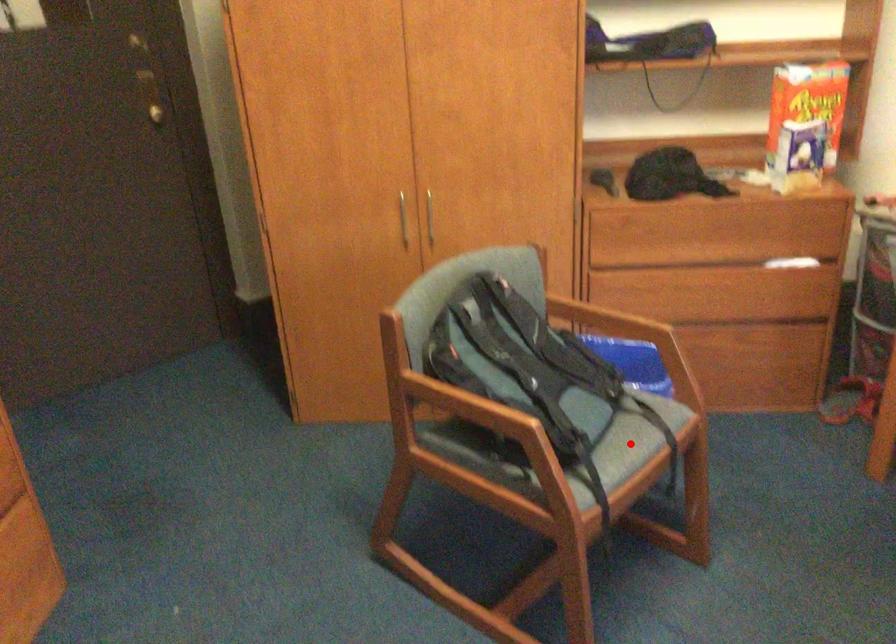
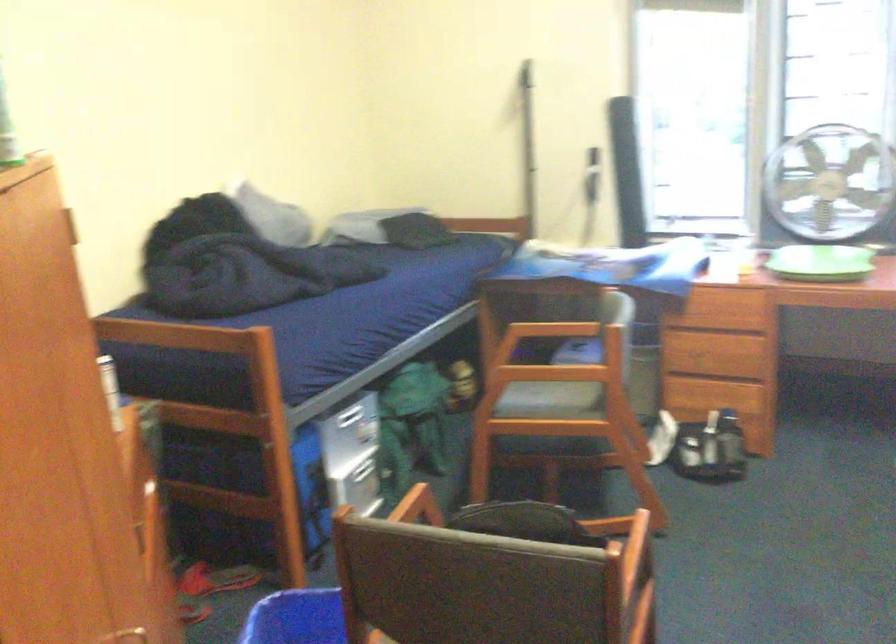
Question: I am providing you with two images of the same scene from different viewpoints. A red point is marked on the first image. At the location where the point appears in image 1, is it still visible in image 2?

Choices:
 (A) Yes
 (B) No

Answer: (B)